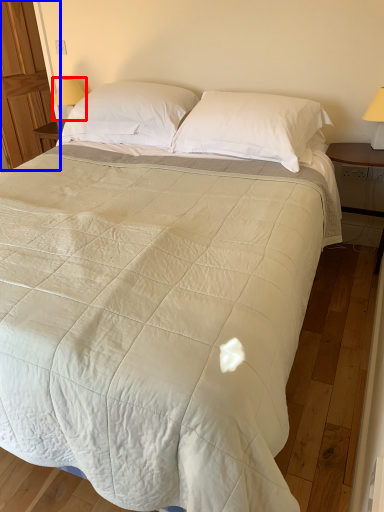
Question: Which point is further to the camera, table lamp (highlighted by a red box) or armoire (highlighted by a blue box)?

Choices:
 (A) table lamp
 (B) armoire

Answer: (B)